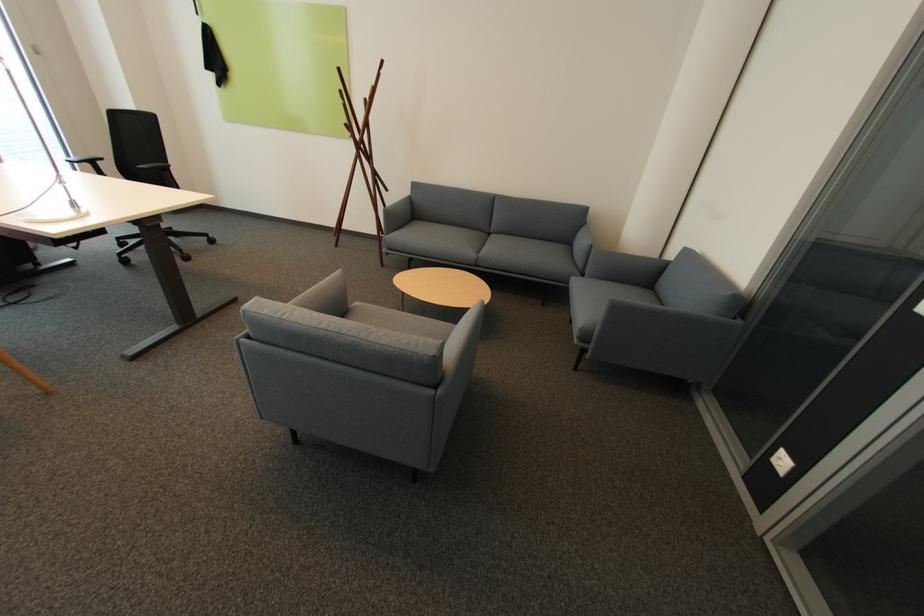
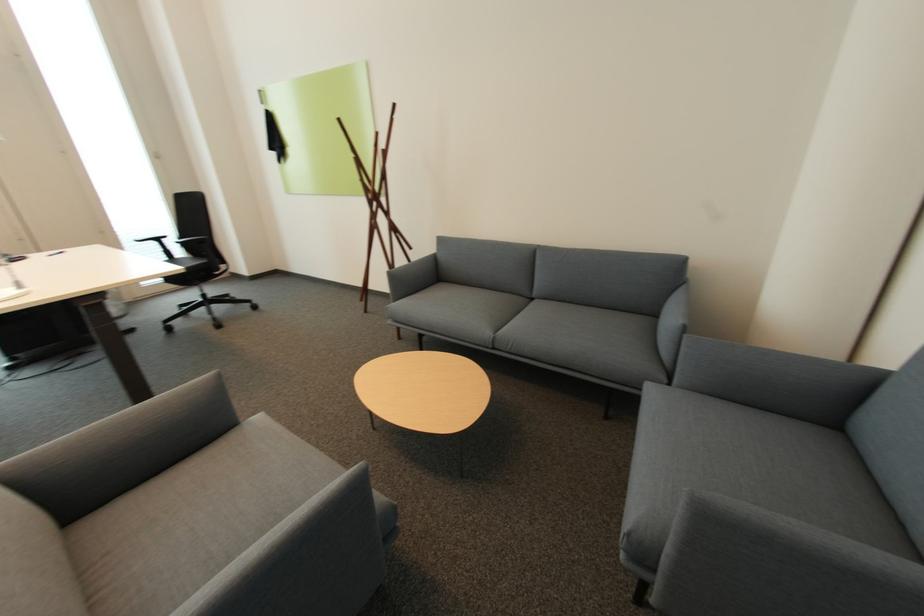
Where in the second image is the point corresponding to (x=346, y=270) from the first image?

(219, 373)